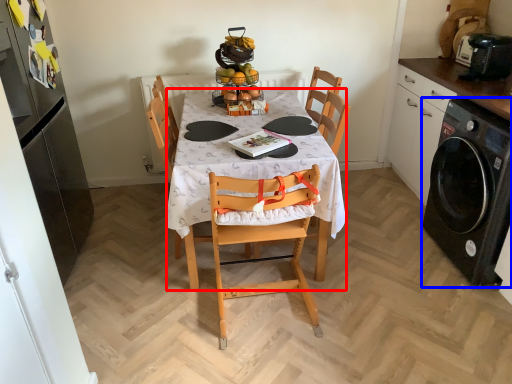
Question: Which of the following is the farthest to the observer, desk (highlighted by a red box) or kitchen appliance (highlighted by a blue box)?

Choices:
 (A) desk
 (B) kitchen appliance

Answer: (B)